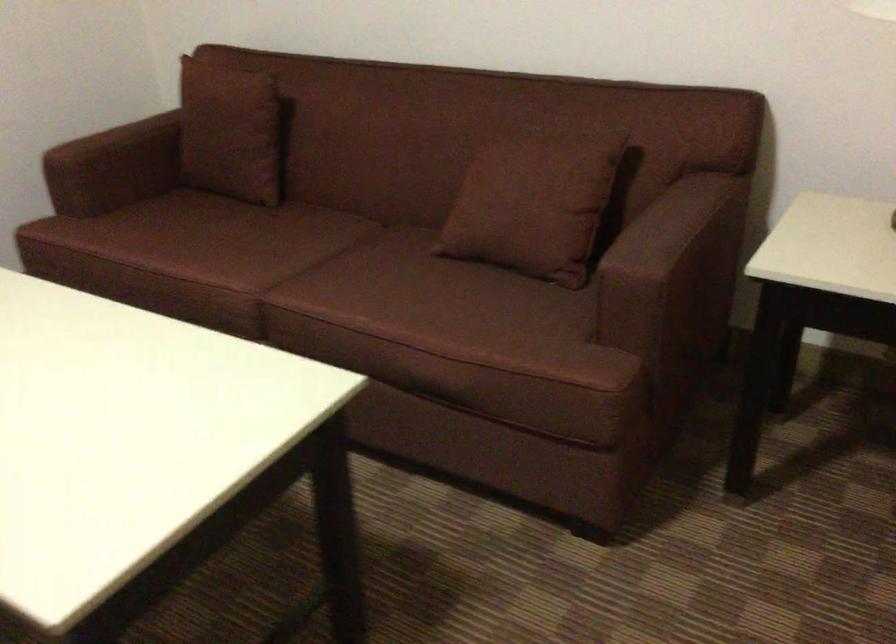
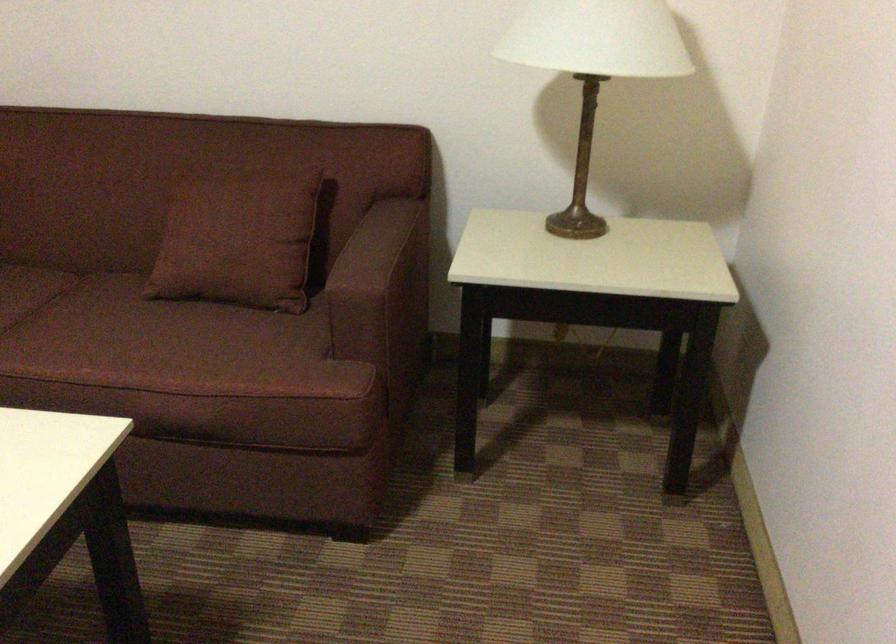
Locate, in the second image, the point that corresponds to pixel 410 294 in the first image.

(135, 339)